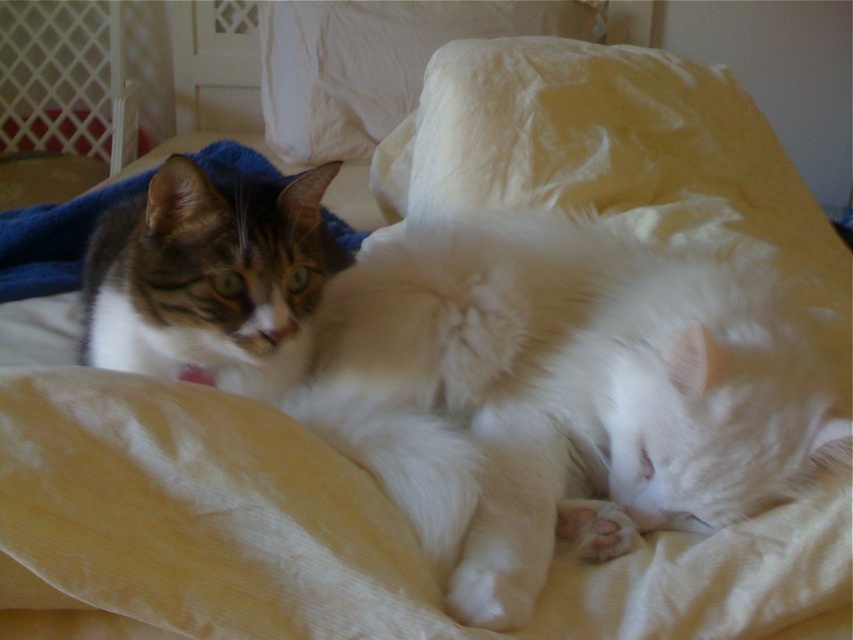
You are a photographer trying to capture a closeup of the tabby fur cat at left. Given that your camera can focus on subjects within 25 inches, will you need to move closer or farther away to get a clear shot?

The tabby fur cat at left is 27.94 inches away from viewer. Since the camera requires subjects to be within 25 inches for focus, you need to move closer by approximately 2.94 inches to ensure a clear closeup.

You are a photographer trying to capture both cats in a single shot. The tabby fur cat at left is to the left of the white soft pillow at upper center. Which cat is positioned closer to the left edge of the photo?

The tabby fur cat at left is positioned closer to the left edge of the photo than the white soft pillow at upper center.

You are a cat owner who wants to place a small toy between the two cats. The toy is 10 inches long. Is there enough space between the tabby fur cat at upper left and the other cat to fit the toy?

The two cats are 23.25 inches apart, so yes, the 10 inch toy can fit between the tabby fur cat at upper left and the other cat.